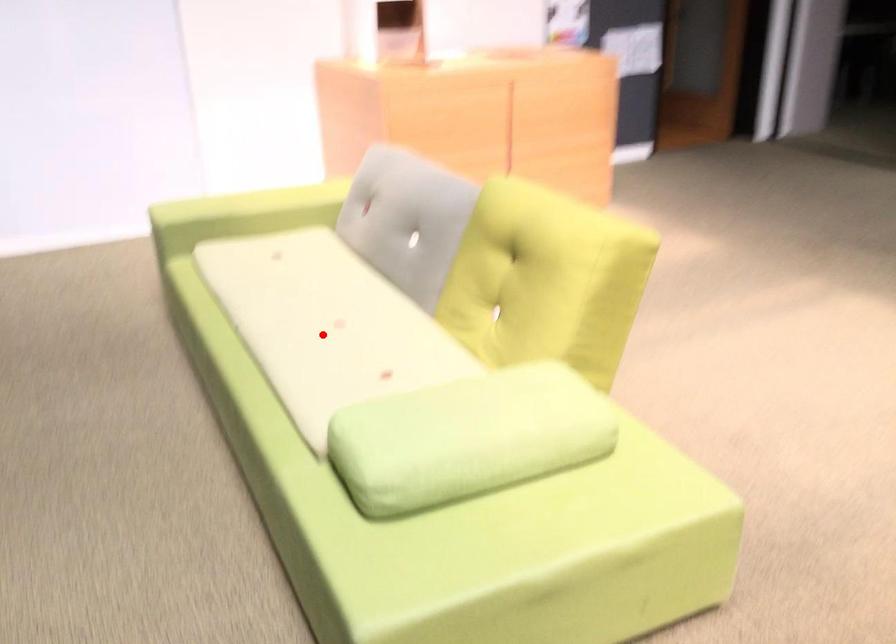
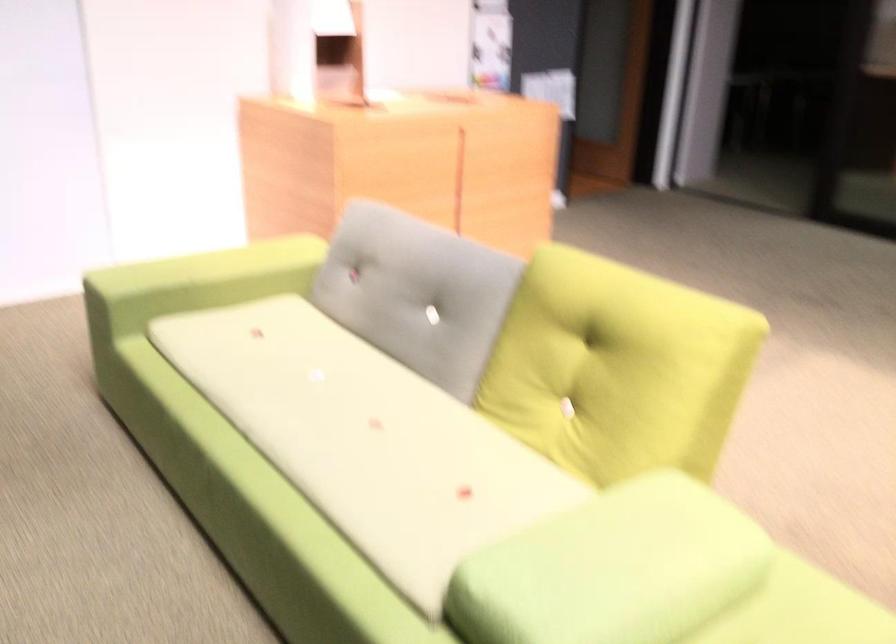
The point at the highlighted location is marked in the first image. Where is the corresponding point in the second image?

(366, 439)